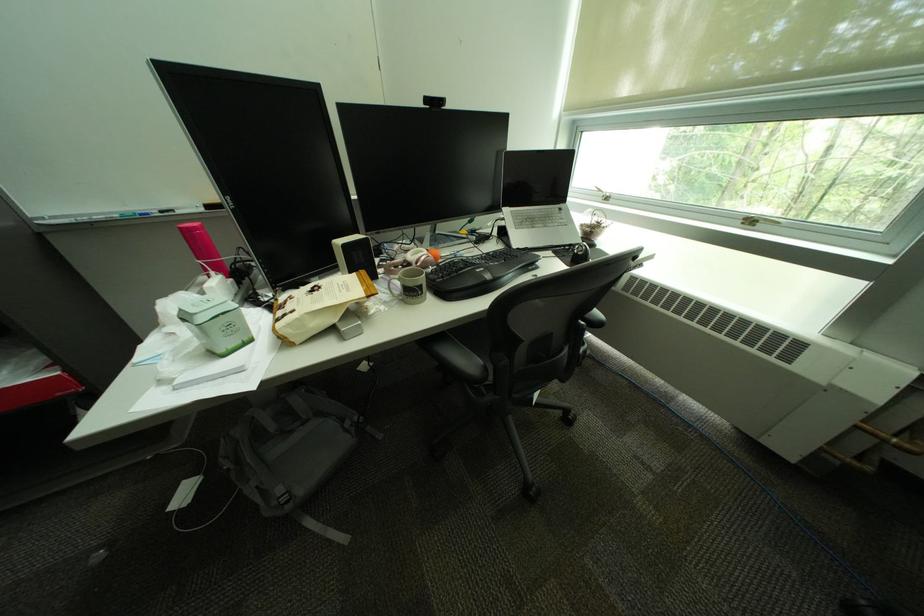
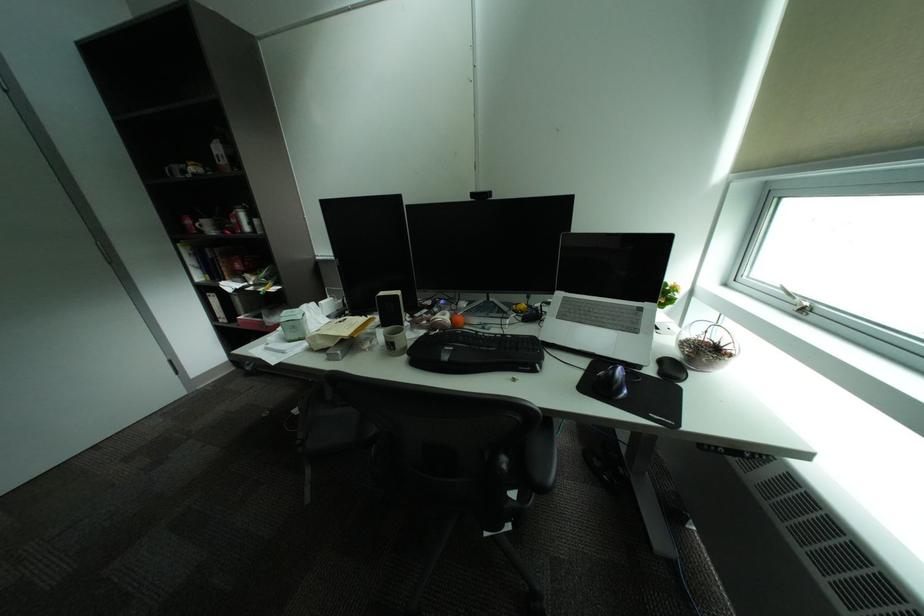
In the second image, find the point that corresponds to (432,253) in the first image.

(456, 315)